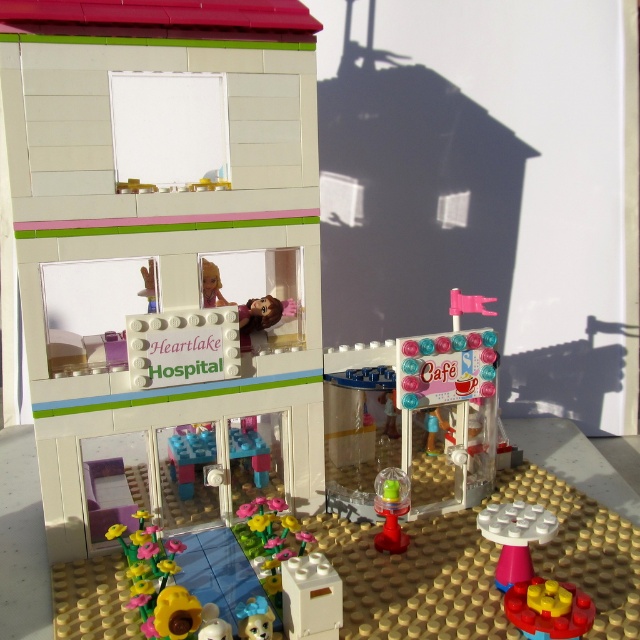
Question: Which object is closer to the camera taking this photo?

Choices:
 (A) white plastic table at lower center
 (B) translucent yellow plastic cup at lower center
 (C) translucent plastic flower pot at lower center

Answer: (A)

Question: Does white plastic table at lower center appear on the left side of translucent yellow plastic cup at lower center?

Choices:
 (A) no
 (B) yes

Answer: (A)

Question: Which point is closer to the camera taking this photo?

Choices:
 (A) (516, 586)
 (B) (193, 492)
 (C) (504, 522)
 (D) (385, 508)

Answer: (A)

Question: Among these objects, which one is farthest from the camera?

Choices:
 (A) translucent plastic flower pot at lower center
 (B) white plastic table at lower center

Answer: (A)

Question: Can you confirm if translucent plastic flower pot at lower center is thinner than translucent yellow plastic cup at lower center?

Choices:
 (A) yes
 (B) no

Answer: (B)

Question: Is yellow rubber toy at lower right to the right of translucent plastic flower pot at lower center from the viewer's perspective?

Choices:
 (A) yes
 (B) no

Answer: (A)